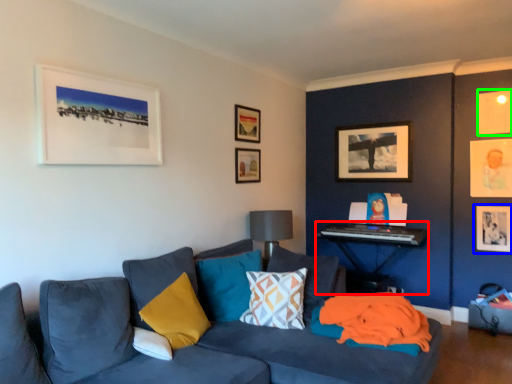
Question: Which object is the farthest from table (highlighted by a red box)? Choose among these: picture frame (highlighted by a blue box) or picture frame (highlighted by a green box).

Choices:
 (A) picture frame
 (B) picture frame

Answer: (B)